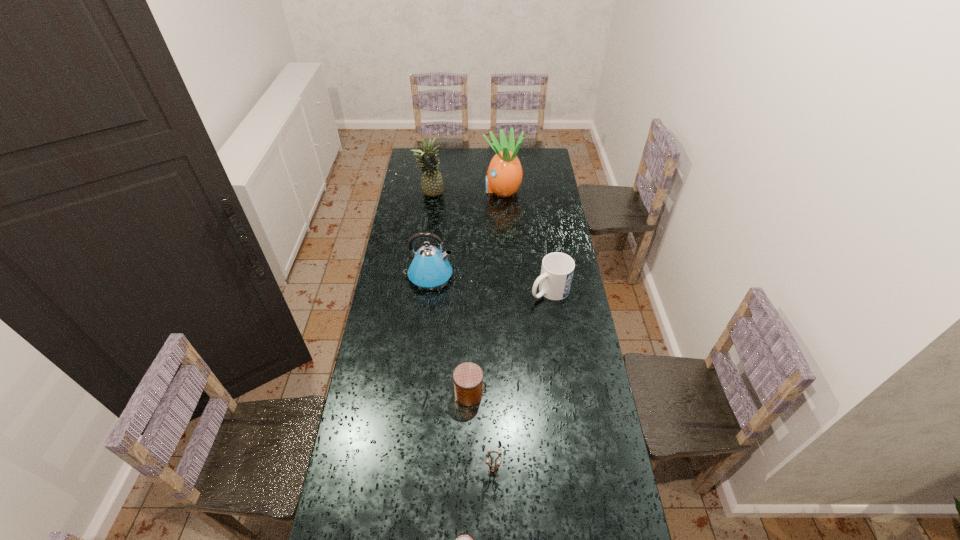
Where is `vacant region located at the spout of the kettle`? This screenshot has height=540, width=960. vacant region located at the spout of the kettle is located at coordinates (521, 275).

You are a GUI agent. You are given a task and a screenshot of the screen. Output one action in this format:
    pyautogui.click(x=<x>, y=<y>)
    Task: Click on the blank area located on the back of the fourth shortest object
    The image size is (960, 540).
    Given the screenshot: What is the action you would take?
    pyautogui.click(x=540, y=225)

You are a GUI agent. You are given a task and a screenshot of the screen. Output one action in this format:
    pyautogui.click(x=<x>, y=<y>)
    Task: Click on the free space located on the right of the jar
    This screenshot has height=540, width=960.
    Given the screenshot: What is the action you would take?
    pyautogui.click(x=583, y=393)

At what (x,y) coordinates should I click in order to perform the action: click on free spot located 0.380m on the back of the second nearest object. Please return your answer as a coordinate pair (x, y). This screenshot has height=540, width=960. Looking at the image, I should click on (491, 363).

Locate an element on the screen. pineapple that is at the left edge is located at coordinates (432, 183).

This screenshot has width=960, height=540. In order to click on kettle that is at the left edge in this screenshot , I will do `click(429, 268)`.

The image size is (960, 540). Identify the location of object at the right edge. (557, 270).

The image size is (960, 540). In the image, there is a desktop. Identify the location of vacant space at the far edge. (517, 155).

Image resolution: width=960 pixels, height=540 pixels. I want to click on free space at the left edge of the desktop, so click(421, 207).

In the image, there is a desktop. At what (x,y) coordinates should I click in order to perform the action: click on free region at the right edge. Please return your answer as a coordinate pair (x, y). This screenshot has width=960, height=540. Looking at the image, I should click on (535, 217).